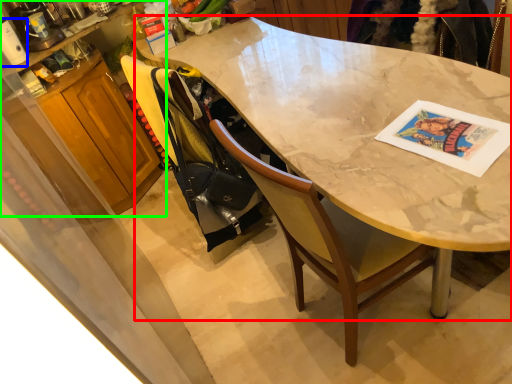
Question: Which object is the farthest from desk (highlighted by a red box)? Choose among these: appliance (highlighted by a blue box) or cabinetry (highlighted by a green box).

Choices:
 (A) appliance
 (B) cabinetry

Answer: (A)